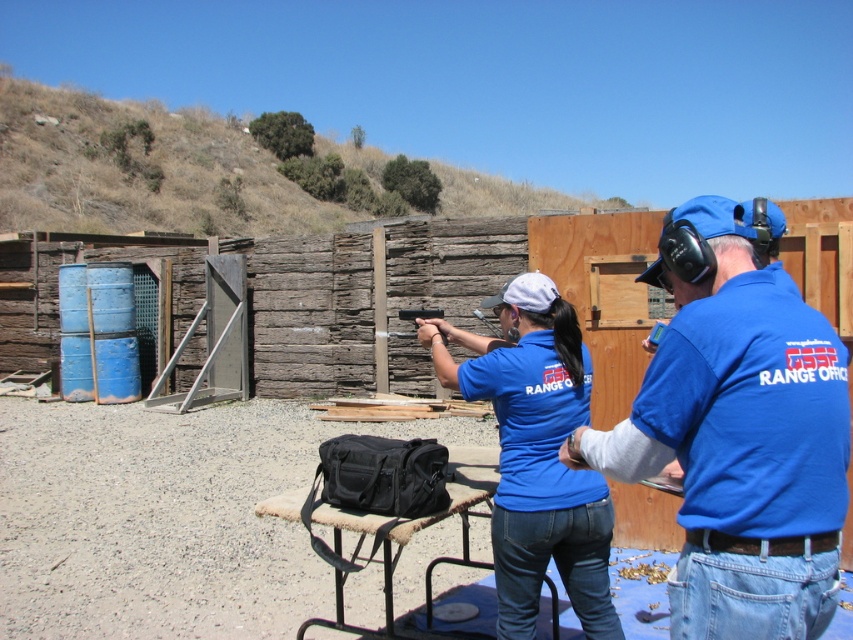
Question: Which point appears closest to the camera in this image?

Choices:
 (A) (407, 336)
 (B) (836, 376)

Answer: (B)

Question: Which point appears farthest from the camera in this image?

Choices:
 (A) pos(833,612)
 (B) pos(593,625)

Answer: (B)

Question: Can you confirm if blue cotton shirt at center is smaller than matte black rifle at center?

Choices:
 (A) no
 (B) yes

Answer: (A)

Question: Can you confirm if blue cotton shirt at center right is thinner than matte black rifle at center?

Choices:
 (A) no
 (B) yes

Answer: (A)

Question: Is blue cotton shirt at center further to the viewer compared to matte black rifle at center?

Choices:
 (A) no
 (B) yes

Answer: (A)

Question: Based on their relative distances, which object is nearer to the matte black rifle at center?

Choices:
 (A) blue cotton shirt at center
 (B) blue cotton shirt at center right

Answer: (A)